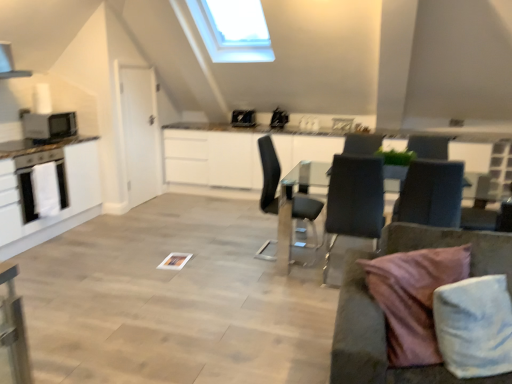
Question: Based on their positions, is satin black laptop at upper center, which appears as the 2th appliance when viewed from the front, located to the left or right of matte black microwave at left, positioned as the 1th appliance in left-to-right order?

Choices:
 (A) left
 (B) right

Answer: (B)

Question: Considering the positions of satin black laptop at upper center, which ranks as the second appliance in back-to-front order, and matte black microwave at left, acting as the 3th appliance starting from the back, in the image, is satin black laptop at upper center, which ranks as the second appliance in back-to-front order, taller or shorter than matte black microwave at left, acting as the 3th appliance starting from the back,?

Choices:
 (A) short
 (B) tall

Answer: (A)

Question: Estimate the real-world distances between objects in this image. Which object is farther from the dark gray fabric chair at center, the 3th chair positioned from the left?

Choices:
 (A) pink fabric pillow at lower right
 (B) black leather chair at center, which is the 3th chair in right-to-left order
 (C) matte black microwave at left, acting as the 3th appliance starting from the back
 (D) glossy white counter at center
 (E) white glossy exhaust hood at upper left

Answer: (E)

Question: Considering the real-world distances, which object is closest to the white glossy sink at upper center?

Choices:
 (A) black leather chair at center, which is the 3th chair in right-to-left order
 (B) glossy white counter at center
 (C) matte black microwave at left, acting as the 3th appliance starting from the back
 (D) pink fabric pillow at lower right
 (E) transparent glass table at center

Answer: (B)